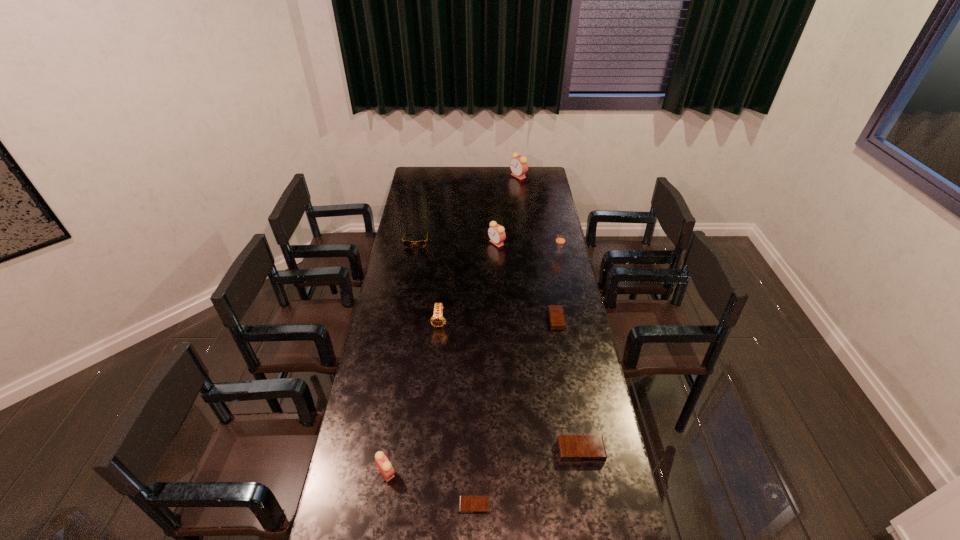
Where is `free location located on the front of the fourth farthest object`? The image size is (960, 540). free location located on the front of the fourth farthest object is located at coordinates (563, 272).

You are a GUI agent. You are given a task and a screenshot of the screen. Output one action in this format:
    pyautogui.click(x=<x>, y=<y>)
    Task: Click on the free point located on the face of the fifth nearest alarm clock
    
    Given the screenshot: What is the action you would take?
    pyautogui.click(x=458, y=243)

Identify the location of vacant region located 0.060m on the face of the fifth nearest alarm clock. The image size is (960, 540). (476, 243).

Where is `vacant space located on the face of the fifth nearest alarm clock`? vacant space located on the face of the fifth nearest alarm clock is located at coordinates (414, 243).

The image size is (960, 540). What are the coordinates of `vacant space located 0.140m on the face of the black watch` in the screenshot? It's located at (437, 357).

I want to click on vacant area located on the face of the fourth shortest alarm clock, so click(x=502, y=472).

Where is `vacant space located on the front-facing side of the sunglasses`? The width and height of the screenshot is (960, 540). vacant space located on the front-facing side of the sunglasses is located at coordinates (407, 291).

Locate an element on the screen. vacant space located 0.100m on the front face of the third shortest object is located at coordinates (588, 494).

You are a GUI agent. You are given a task and a screenshot of the screen. Output one action in this format:
    pyautogui.click(x=<x>, y=<y>)
    Task: Click on the free space located 0.260m on the front face of the second shortest alarm clock
    
    Given the screenshot: What is the action you would take?
    pyautogui.click(x=490, y=320)

Locate an element on the screen. Image resolution: width=960 pixels, height=540 pixels. blank area located on the front face of the second shortest alarm clock is located at coordinates (473, 320).